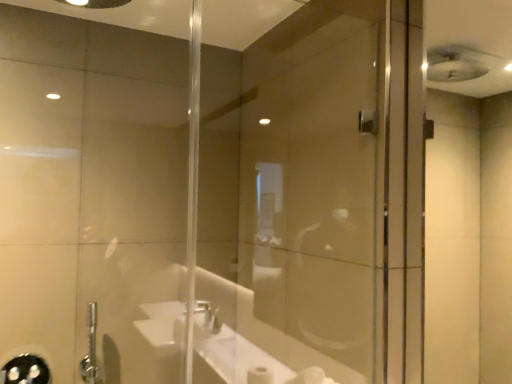
The height and width of the screenshot is (384, 512). Find the location of `transparent glass screen door at center`. transparent glass screen door at center is located at coordinates (315, 201).

The height and width of the screenshot is (384, 512). What do you see at coordinates (315, 201) in the screenshot? I see `transparent glass screen door at center` at bounding box center [315, 201].

Where is `transparent glass screen door at center`? transparent glass screen door at center is located at coordinates (315, 201).